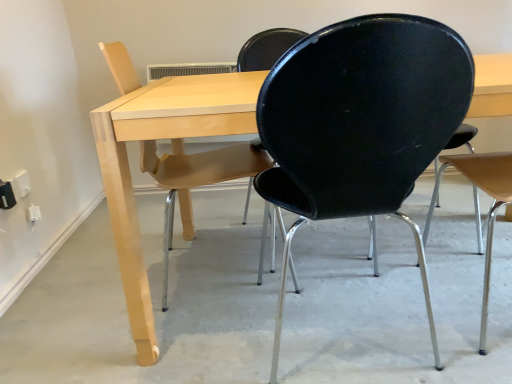
The width and height of the screenshot is (512, 384). Find the location of `vacant region to the right of black plastic chair at center, arranged as the second chair when viewed from the right`. vacant region to the right of black plastic chair at center, arranged as the second chair when viewed from the right is located at coordinates (442, 315).